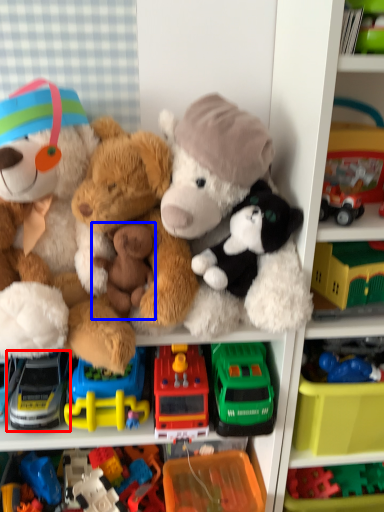
Question: Which object appears farthest to the camera in this image, toy (highlighted by a red box) or toy (highlighted by a blue box)?

Choices:
 (A) toy
 (B) toy

Answer: (A)